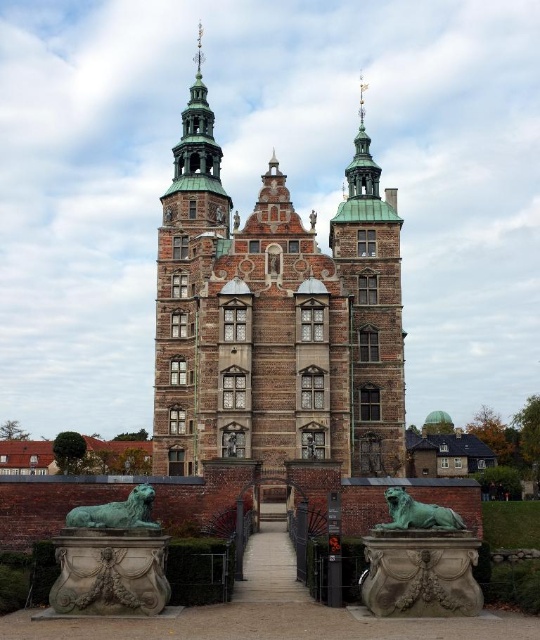
Question: Which object appears farthest from the camera in this image?

Choices:
 (A) brown stone tower at center
 (B) bronze statue at center

Answer: (B)

Question: From the image, what is the correct spatial relationship of brown stone tower at center in relation to green patina stone lion at lower left?

Choices:
 (A) right
 (B) left

Answer: (A)

Question: Is green patina stone lion at lower center to the right of bronze statue at center from the viewer's perspective?

Choices:
 (A) yes
 (B) no

Answer: (A)

Question: Among these points, which one is farthest from the camera?

Choices:
 (A) (225, 452)
 (B) (125, 513)
 (C) (206, 104)

Answer: (C)

Question: Which point is farther to the camera?

Choices:
 (A) brown stone tower at center
 (B) green patina stone lion at lower center
 (C) bronze statue at center
 (D) green patina stone lion at lower left

Answer: (C)

Question: In this image, where is green patina stone lion at lower center located relative to bronze statue at center?

Choices:
 (A) right
 (B) left

Answer: (A)